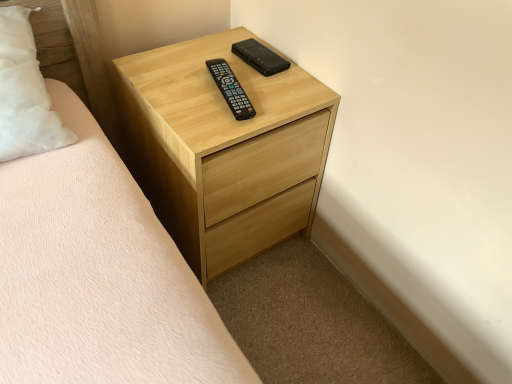
The height and width of the screenshot is (384, 512). What are the coordinates of `vacant region in front of black matte phone at upper center, acting as the 1th control starting from the back` in the screenshot? It's located at (259, 97).